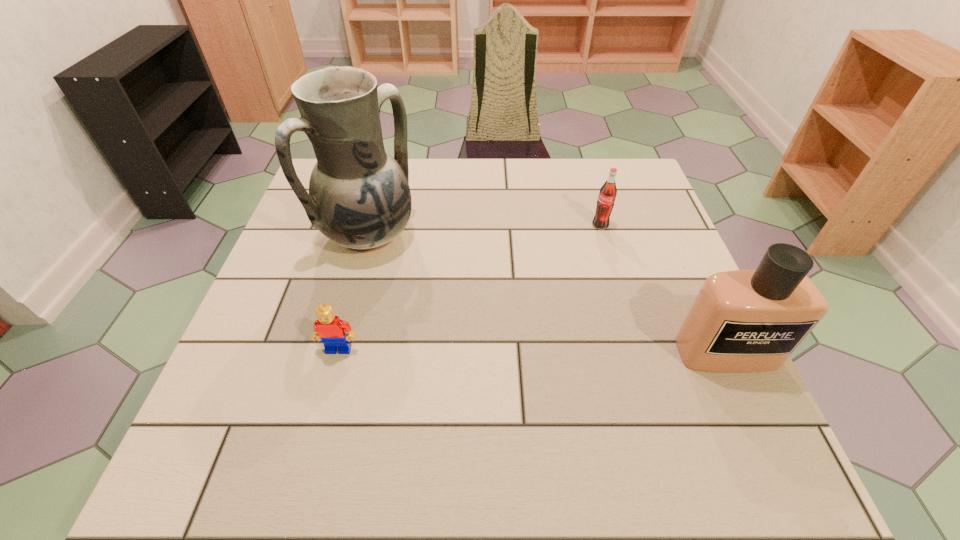
At what (x,y) coordinates should I click in order to perform the action: click on free space between the pitcher and the rightmost object. Please return your answer as a coordinate pair (x, y). This screenshot has height=540, width=960. Looking at the image, I should click on (548, 294).

Identify the location of free space between the soda bottle and the tallest object. The height and width of the screenshot is (540, 960). (485, 231).

You are a GUI agent. You are given a task and a screenshot of the screen. Output one action in this format:
    pyautogui.click(x=<x>, y=<y>)
    Task: Click on the free area in between the pitcher and the Lego
    Image resolution: width=960 pixels, height=540 pixels.
    Given the screenshot: What is the action you would take?
    tap(354, 292)

At what (x,y) coordinates should I click in order to perform the action: click on vacant space that is in between the perfume and the pitcher. Please return your answer as a coordinate pair (x, y). Looking at the image, I should click on (548, 294).

This screenshot has height=540, width=960. Find the location of `empty space between the perfume and the pitcher`. empty space between the perfume and the pitcher is located at coordinates (548, 294).

Identify the location of free area in between the second tallest object and the shortest object. Image resolution: width=960 pixels, height=540 pixels. (533, 351).

Locate which object is the second closest to the pitcher. Please provide its 2D coordinates. Your answer should be formatted as a tuple, i.e. [(x, y)], where the tuple contains the x and y coordinates of a point satisfying the conditions above.

[(605, 203)]

Identify the location of object that stands as the second closest to the shortest object. (743, 320).

At what (x,y) coordinates should I click in order to perform the action: click on vacant region that satisfies the following two spatial constraints: 1. on the back side of the second object from right to left; 2. on the left side of the tallest object. Please return your answer as a coordinate pair (x, y). The image size is (960, 540). Looking at the image, I should click on (372, 225).